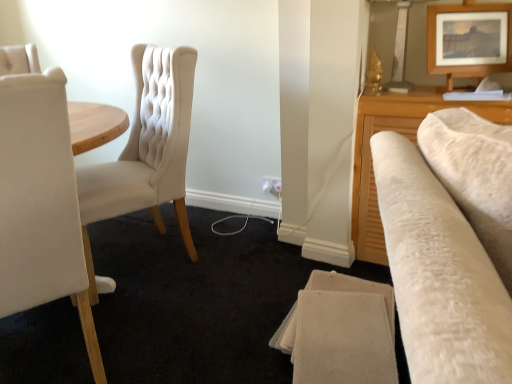
At what (x,y) coordinates should I click in order to perform the action: click on vacant space to the right of matte cream fabric chair at left, the 1th chair from the back. Please return your answer as a coordinate pair (x, y). The image size is (512, 384). Looking at the image, I should click on (237, 265).